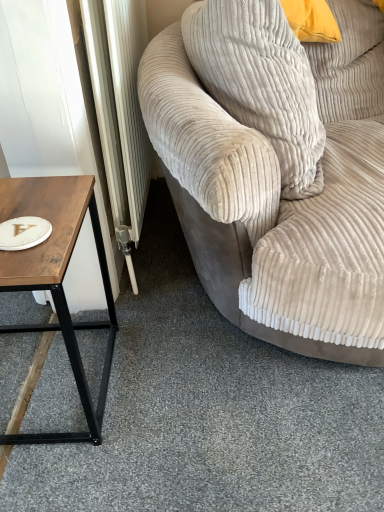
Question: From the image's perspective, would you say wooden table at left is positioned over beige corduroy couch at right?

Choices:
 (A) no
 (B) yes

Answer: (A)

Question: Could beige corduroy couch at right be considered to be inside wooden table at left?

Choices:
 (A) no
 (B) yes

Answer: (A)

Question: Is wooden table at left oriented towards beige corduroy couch at right?

Choices:
 (A) yes
 (B) no

Answer: (B)

Question: Does wooden table at left have a lesser height compared to beige corduroy couch at right?

Choices:
 (A) yes
 (B) no

Answer: (A)

Question: Does wooden table at left have a greater height compared to beige corduroy couch at right?

Choices:
 (A) no
 (B) yes

Answer: (A)

Question: Is wooden table at left to the right of beige corduroy couch at right from the viewer's perspective?

Choices:
 (A) yes
 (B) no

Answer: (B)

Question: Is beige corduroy couch at right far from wooden table at left?

Choices:
 (A) yes
 (B) no

Answer: (B)

Question: Would you say beige corduroy couch at right is outside wooden table at left?

Choices:
 (A) no
 (B) yes

Answer: (B)

Question: Considering the relative positions of beige corduroy couch at right and wooden table at left in the image provided, is beige corduroy couch at right behind wooden table at left?

Choices:
 (A) no
 (B) yes

Answer: (A)

Question: Can you confirm if beige corduroy couch at right is positioned to the right of wooden table at left?

Choices:
 (A) yes
 (B) no

Answer: (A)

Question: Does beige corduroy couch at right touch wooden table at left?

Choices:
 (A) yes
 (B) no

Answer: (B)

Question: Does beige corduroy couch at right have a lesser width compared to wooden table at left?

Choices:
 (A) no
 (B) yes

Answer: (A)

Question: Does wooden table at left have a lesser width compared to beige corduroy pillow at upper right?

Choices:
 (A) no
 (B) yes

Answer: (A)